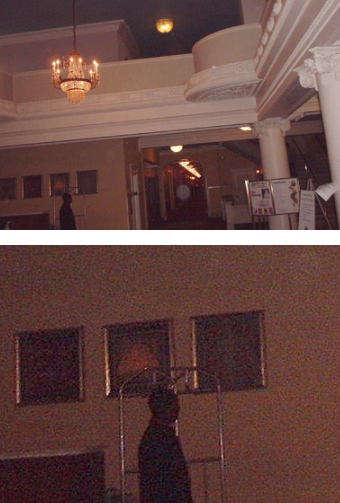
The image size is (340, 503). I want to click on walls side, so click(101, 147), click(111, 285).